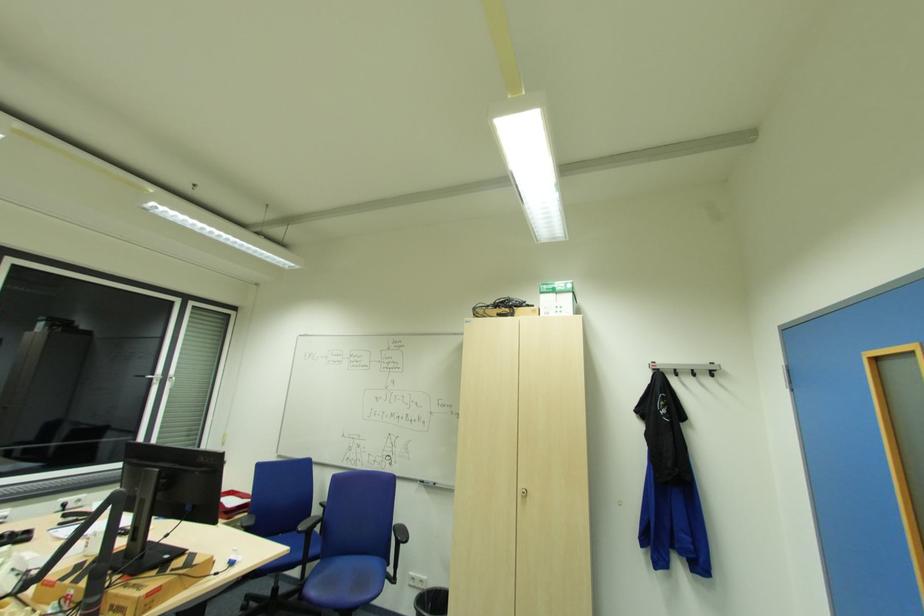
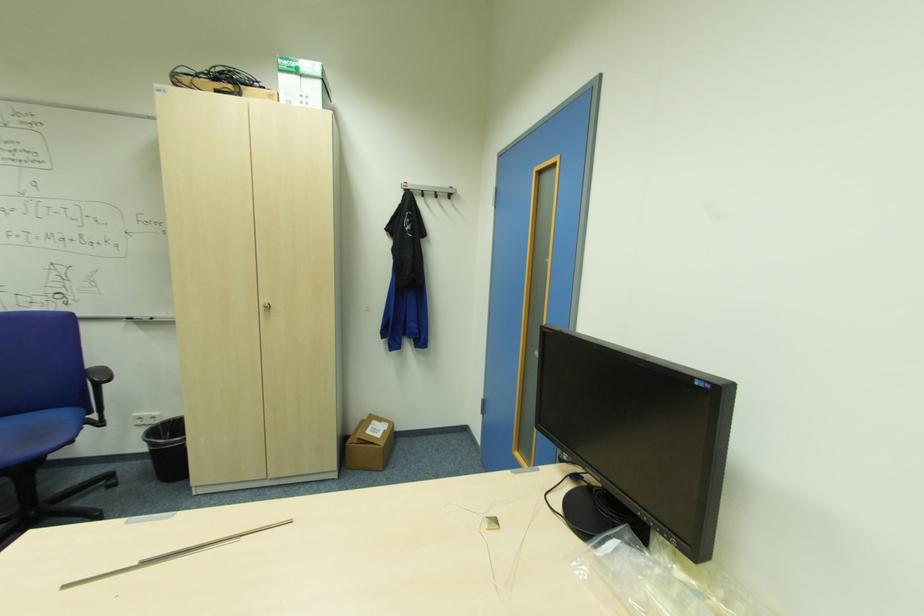
In the second image, find the point that corresponds to the point at 548,290 in the first image.

(287, 69)